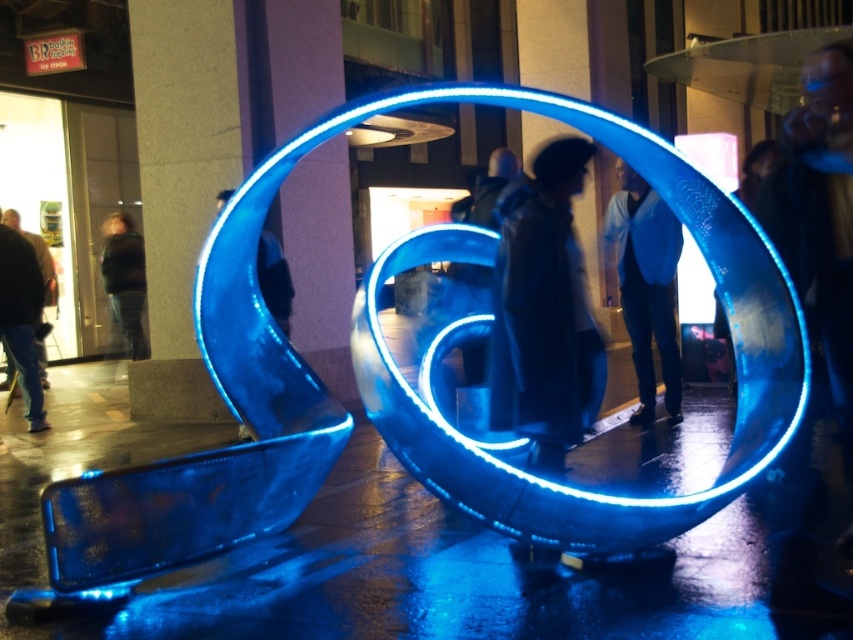
You are standing in the urban night scene and want to take a photo of the dark gray hoodie at center and the dark green jacket at left. Which one will appear closer to the camera in the photo?

The dark gray hoodie at center will appear closer to the camera in the photo because it is in front of the dark green jacket at left.

You are a photographer setting up a tripod in the urban night scene. You need to position your equipment between the dark gray hoodie at center and the dark green jacket at left. Given their sizes, which object might you need to move to ensure enough space for your setup?

The dark gray hoodie at center occupies less space than the dark green jacket at left, so you might need to move the dark green jacket at left to create more space for your equipment setup.

You are standing in the urban night scene and see the blue glossy jacket at center and the dark green jacket at left. Which jacket is closer to you?

The blue glossy jacket at center is closer to you because it is in front of the dark green jacket at left.